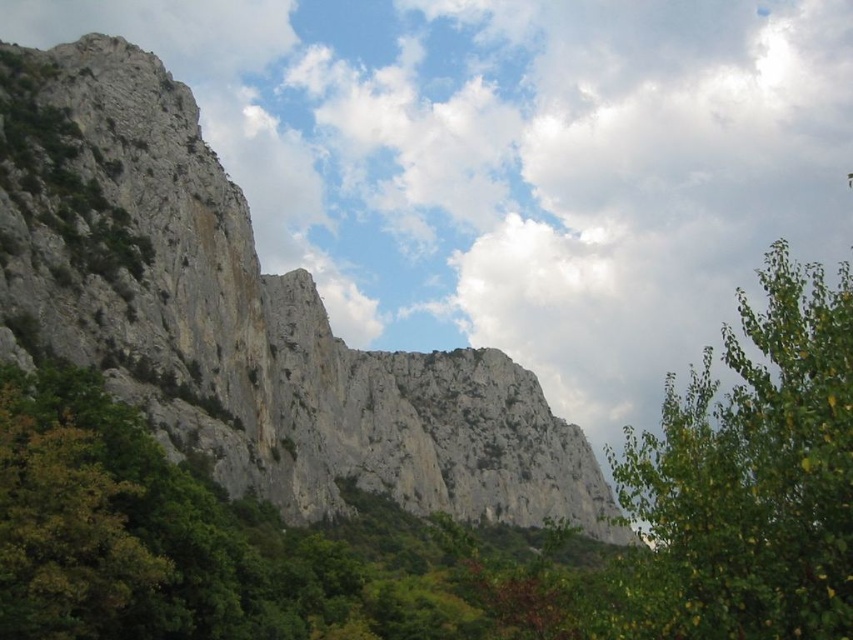
You are standing at the base of the cliff and see the point marked at coordinates (242,317). What is the color of the rock at that location?

The point at coordinates (242,317) marks gray rock at center.

You are a hiker standing at the base of the cliff. You see the gray rock at center and the green leafy tree at upper right. Which object is closer to you?

The gray rock at center is closer to you since it is positioned at the center of the cliff, while the green leafy tree at upper right is located further away at the upper right corner of the scene.